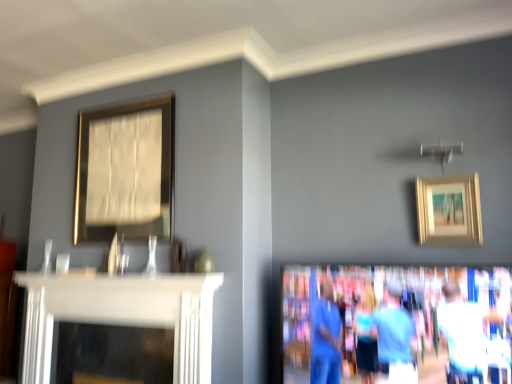
Question: Is gold metallic picture frame at upper left, the first picture frame in the left-to-right sequence, at the right side of gold/golden frame at upper right, which ranks as the 1th picture frame in right-to-left order?

Choices:
 (A) no
 (B) yes

Answer: (A)

Question: Considering the relative sizes of gold metallic picture frame at upper left, the second picture frame in the front-to-back sequence, and gold/golden frame at upper right, which ranks as the 1th picture frame in right-to-left order, in the image provided, is gold metallic picture frame at upper left, the second picture frame in the front-to-back sequence, bigger than gold/golden frame at upper right, which ranks as the 1th picture frame in right-to-left order,?

Choices:
 (A) no
 (B) yes

Answer: (B)

Question: From a real-world perspective, is gold metallic picture frame at upper left, the second picture frame in the front-to-back sequence, located higher than gold/golden frame at upper right, the first picture frame from the front?

Choices:
 (A) no
 (B) yes

Answer: (B)

Question: Is gold metallic picture frame at upper left, the first picture frame in the left-to-right sequence, positioned in front of gold/golden frame at upper right, which ranks as the 1th picture frame in right-to-left order?

Choices:
 (A) yes
 (B) no

Answer: (B)

Question: Is gold metallic picture frame at upper left, the second picture frame in the front-to-back sequence, oriented towards gold/golden frame at upper right, positioned as the 2th picture frame in back-to-front order?

Choices:
 (A) yes
 (B) no

Answer: (B)

Question: Is blue fabric couple at lower right bigger or smaller than gold metallic picture frame at upper left, the first picture frame in the left-to-right sequence?

Choices:
 (A) big
 (B) small

Answer: (A)

Question: Is point (404, 337) positioned closer to the camera than point (164, 130)?

Choices:
 (A) farther
 (B) closer

Answer: (B)

Question: In terms of height, does blue fabric couple at lower right look taller or shorter compared to gold metallic picture frame at upper left, the second picture frame in the front-to-back sequence?

Choices:
 (A) short
 (B) tall

Answer: (A)

Question: From the image's perspective, is blue fabric couple at lower right above or below gold metallic picture frame at upper left, the first picture frame viewed from the back?

Choices:
 (A) above
 (B) below

Answer: (B)

Question: From the image's perspective, is gold metallic picture frame at upper left, the second picture frame in the front-to-back sequence, above or below blue fabric couple at lower right?

Choices:
 (A) above
 (B) below

Answer: (A)

Question: Is gold metallic picture frame at upper left, the first picture frame viewed from the back, wider or thinner than blue fabric couple at lower right?

Choices:
 (A) thin
 (B) wide

Answer: (A)

Question: Is gold metallic picture frame at upper left, the first picture frame viewed from the back, situated inside blue fabric couple at lower right or outside?

Choices:
 (A) inside
 (B) outside

Answer: (B)

Question: Looking at the image, does gold metallic picture frame at upper left, which ranks as the second picture frame in right-to-left order, seem bigger or smaller compared to blue fabric couple at lower right?

Choices:
 (A) small
 (B) big

Answer: (A)

Question: Considering the relative positions of gold metallic picture frame at upper left, which ranks as the second picture frame in right-to-left order, and gold/golden frame at upper right, positioned as the 2th picture frame in back-to-front order, in the image provided, is gold metallic picture frame at upper left, which ranks as the second picture frame in right-to-left order, to the left or to the right of gold/golden frame at upper right, positioned as the 2th picture frame in back-to-front order,?

Choices:
 (A) left
 (B) right

Answer: (A)

Question: Is point (124, 170) positioned closer to the camera than point (433, 190)?

Choices:
 (A) farther
 (B) closer

Answer: (A)